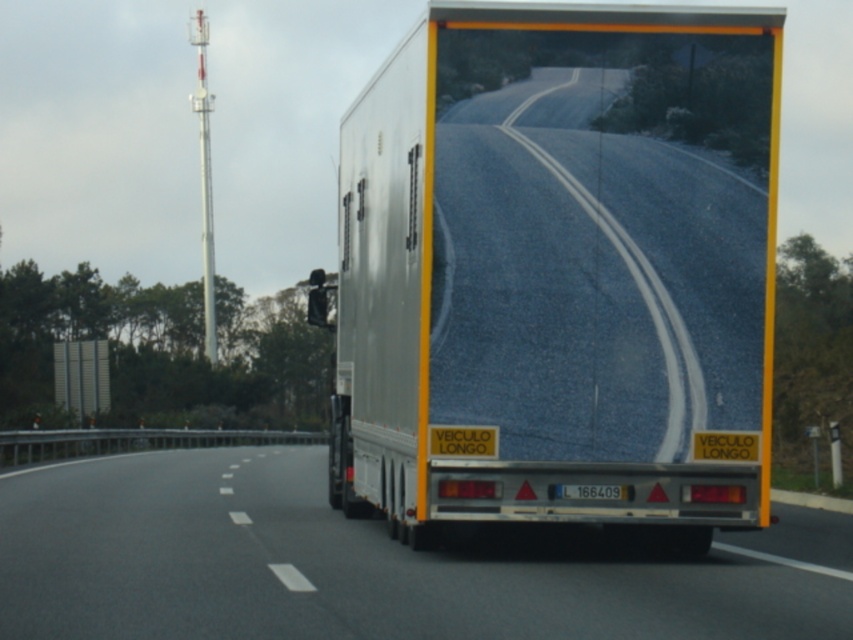
Who is more distant from viewer, (773, 90) or (178, 534)?

Positioned behind is point (178, 534).

Measure the distance between silver metallic trailer truck at center and camera.

silver metallic trailer truck at center and camera are 13.07 meters apart from each other.

Which is behind, point (496, 97) or point (18, 480)?

The point (18, 480) is behind.

At what (x,y) coordinates should I click in order to perform the action: click on silver metallic trailer truck at center. Please return your answer as a coordinate pair (x, y). The width and height of the screenshot is (853, 640). Looking at the image, I should click on (560, 272).